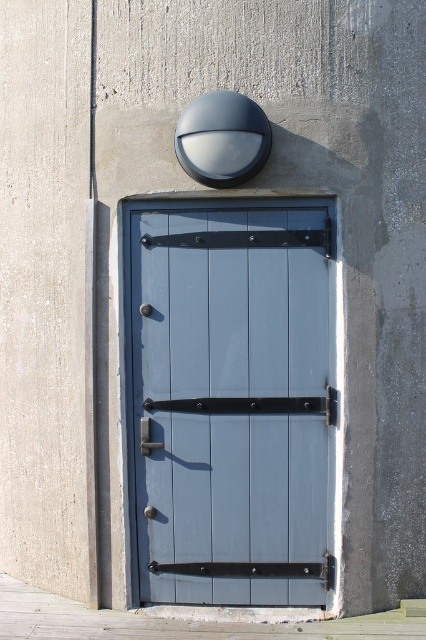
Locate an element on the screen. The height and width of the screenshot is (640, 426). matte wood door at center is located at coordinates (232, 400).

Between point (302, 461) and point (147, 433), which one is positioned behind?

Point (147, 433)

The height and width of the screenshot is (640, 426). I want to click on matte wood door at center, so click(232, 400).